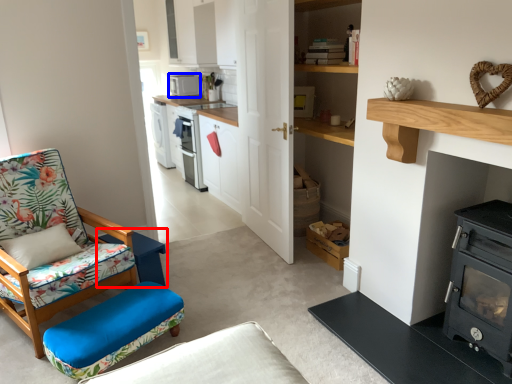
Question: Among these objects, which one is farthest to the camera, table (highlighted by a red box) or appliance (highlighted by a blue box)?

Choices:
 (A) table
 (B) appliance

Answer: (B)